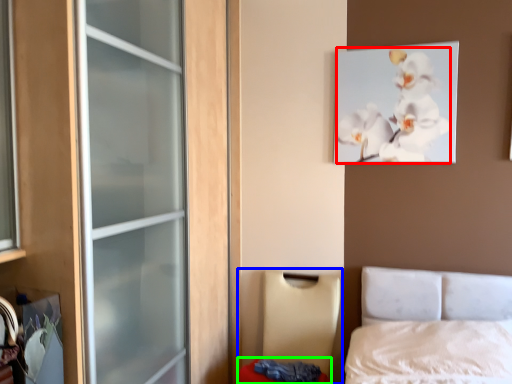
Question: Considering the real-world distances, which object is farthest from flower (highlighted by a red box)? furniture (highlighted by a blue box) or mattress (highlighted by a green box)?

Choices:
 (A) furniture
 (B) mattress

Answer: (B)